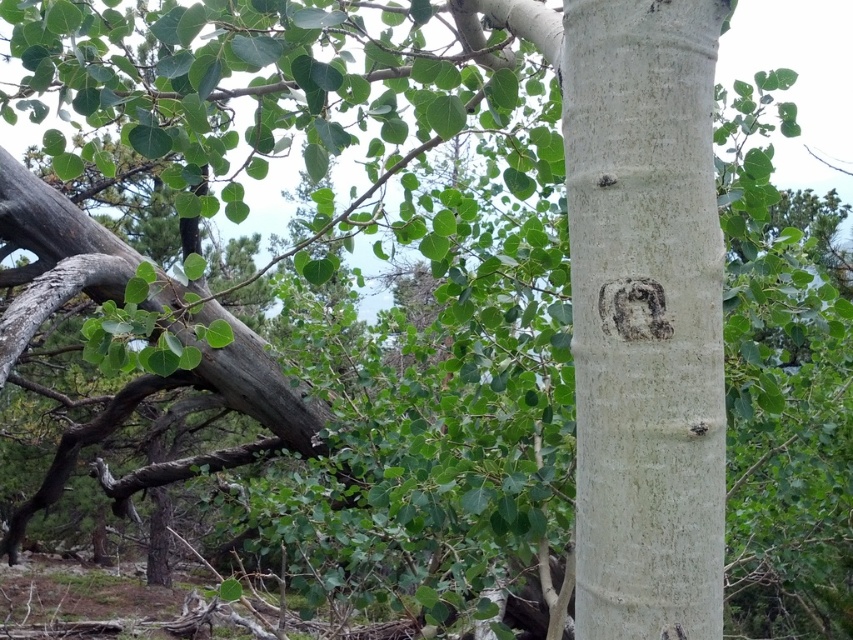
Question: Does white smooth tree trunk at center have a larger size compared to smooth gray stone face at center?

Choices:
 (A) yes
 (B) no

Answer: (A)

Question: Which object appears farthest from the camera in this image?

Choices:
 (A) smooth gray stone face at center
 (B) white smooth tree trunk at center

Answer: (A)

Question: Is white smooth tree trunk at center to the right of smooth gray stone face at center from the viewer's perspective?

Choices:
 (A) yes
 (B) no

Answer: (A)

Question: Which point is closer to the camera taking this photo?

Choices:
 (A) (679, 132)
 (B) (659, 300)

Answer: (B)

Question: Where is white smooth tree trunk at center located in relation to smooth gray stone face at center in the image?

Choices:
 (A) below
 (B) above

Answer: (A)